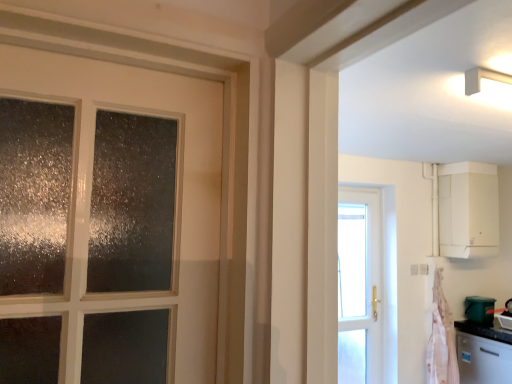
Question: In terms of height, does satin silver dishwasher at lower right look taller or shorter compared to green plastic bucket at lower right?

Choices:
 (A) tall
 (B) short

Answer: (A)

Question: Would you say satin silver dishwasher at lower right is to the left or to the right of green plastic bucket at lower right in the picture?

Choices:
 (A) right
 (B) left

Answer: (A)

Question: Estimate the real-world distances between objects in this image. Which object is farther from the satin silver dishwasher at lower right?

Choices:
 (A) white matte cabinet at upper right
 (B) green plastic bucket at lower right
 (C) pink fabric at right

Answer: (A)

Question: Based on their relative distances, which object is farther from the green plastic bucket at lower right?

Choices:
 (A) satin silver dishwasher at lower right
 (B) pink fabric at right
 (C) white matte cabinet at upper right

Answer: (C)